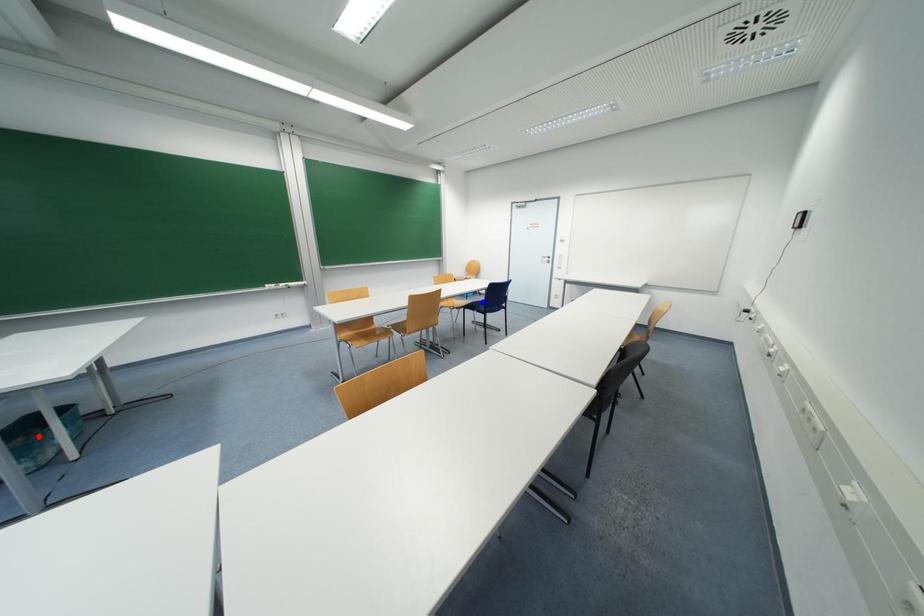
Question: Two points are marked on the image. Which point is closer to the camera?

Choices:
 (A) Blue point is closer.
 (B) Red point is closer.

Answer: (B)